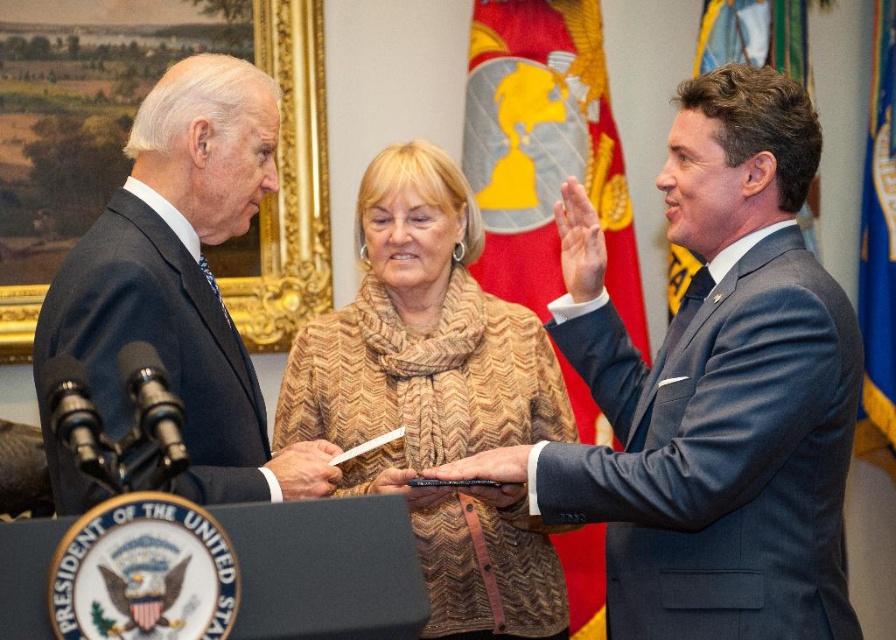
Does dark blue wool suit at left appear over smooth brown leather pen at center?

Correct, dark blue wool suit at left is located above smooth brown leather pen at center.

Is point (200, 483) farther from viewer compared to point (319, 458)?

No, it is not.

Identify the location of dark blue wool suit at left. (154, 348).

Is metallic pen at center further to the viewer compared to smooth leather pen at center?

No, metallic pen at center is closer to the viewer.

Which is more to the left, metallic pen at center or smooth leather pen at center?

Positioned to the left is smooth leather pen at center.

You are a GUI agent. You are given a task and a screenshot of the screen. Output one action in this format:
    pyautogui.click(x=<x>, y=<y>)
    Task: Click on the metallic pen at center
    This screenshot has width=896, height=640.
    Given the screenshot: What is the action you would take?
    pyautogui.click(x=489, y=474)

How distant is smooth brown leather pen at center from smooth leather pen at center?

smooth brown leather pen at center and smooth leather pen at center are 27.36 inches apart from each other.

Is smooth brown leather pen at center bigger than smooth leather pen at center?

Actually, smooth brown leather pen at center might be smaller than smooth leather pen at center.

The width and height of the screenshot is (896, 640). Identify the location of smooth brown leather pen at center. (306, 468).